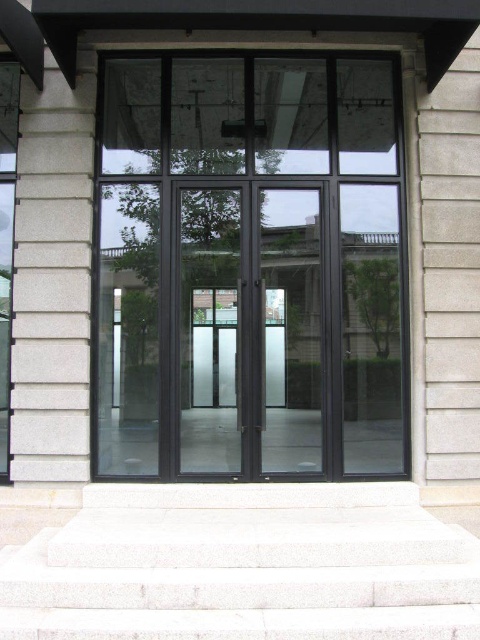
You are a delivery person trying to enter the building through the entrance. You notice the black glass window at center and the white stone stairs at center. Which object is narrower in width?

The black glass window at center is thinner than the white stone stairs at center, so the black glass window at center is narrower in width.

You are a delivery person trying to enter the building through the entrance. The black glass window at center is too reflective to see through. To locate the door handle, should you look above or below the white stone stairs at center?

The black glass window at center is above the white stone stairs at center, so the door handle is likely located above the white stone stairs at center.

You are standing at the entrance of the building and want to walk towards the point labeled as point (x=243, y=529). Which direction should you move relative to the other point labeled point (x=203, y=189)?

You should move towards the point (x=243, y=529), which is in front of the point (x=203, y=189). Since point (x=203, y=189) is behind point (x=243, y=529), moving towards the latter would mean heading away from the former.